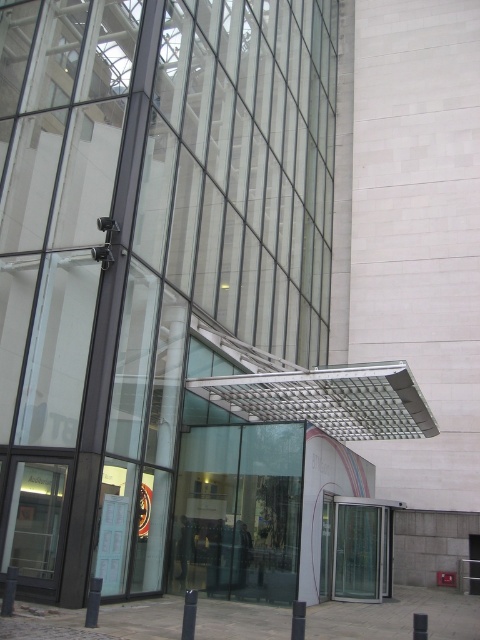
Question: Can you confirm if transparent glass door at center is bigger than transparent glass door at lower center?

Choices:
 (A) yes
 (B) no

Answer: (A)

Question: Can you confirm if transparent glass door at center is wider than transparent glass door at lower center?

Choices:
 (A) yes
 (B) no

Answer: (A)

Question: Can you confirm if transparent glass door at center is positioned above transparent glass door at lower center?

Choices:
 (A) no
 (B) yes

Answer: (B)

Question: Which object is farther from the camera taking this photo?

Choices:
 (A) transparent glass door at center
 (B) transparent glass door at lower center

Answer: (B)